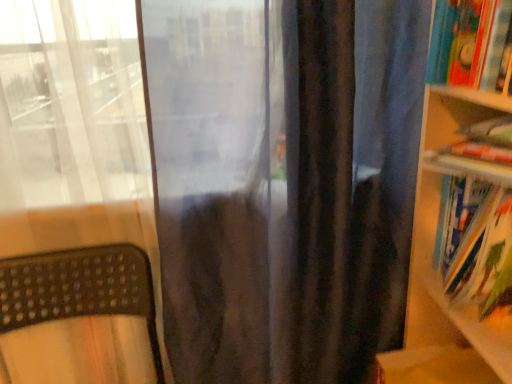
From the picture: Measure the distance between point (470, 260) and camera.

Point (470, 260) is 27.95 inches from camera.

The height and width of the screenshot is (384, 512). In order to click on hardcover book at right, arranged as the first book when ordered from the bottom in this screenshot , I will do `click(475, 244)`.

Which is more distant, [484,40] or [473,314]?

Positioned behind is point [473,314].

Is hardcover books at right completely or partially inside hardcover book at upper right, the 1th book in the top-to-bottom sequence?

No.

Is hardcover book at upper right, which ranks as the 2th book in bottom-to-top order, positioned far away from hardcover books at right?

No, hardcover book at upper right, which ranks as the 2th book in bottom-to-top order, is not far from hardcover books at right.

From a real-world perspective, is hardcover book at right, which ranks as the 2th book in top-to-bottom order, below hardcover book at upper right, which ranks as the 2th book in bottom-to-top order?

Yes, from a real-world perspective, hardcover book at right, which ranks as the 2th book in top-to-bottom order, is beneath hardcover book at upper right, which ranks as the 2th book in bottom-to-top order.

Is hardcover book at right, arranged as the first book when ordered from the bottom, positioned beyond the bounds of hardcover book at upper right, which ranks as the 2th book in bottom-to-top order?

Yes, hardcover book at right, arranged as the first book when ordered from the bottom, is located beyond the bounds of hardcover book at upper right, which ranks as the 2th book in bottom-to-top order.

This screenshot has width=512, height=384. Find the location of `book that appears behind the hardcover book at right, which ranks as the 2th book in top-to-bottom order`. book that appears behind the hardcover book at right, which ranks as the 2th book in top-to-bottom order is located at coordinates (471, 44).

From the image's perspective, is hardcover book at right, arranged as the first book when ordered from the bottom, above or below hardcover book at upper right, the 1th book in the top-to-bottom sequence?

From the image's perspective, hardcover book at right, arranged as the first book when ordered from the bottom, appears below hardcover book at upper right, the 1th book in the top-to-bottom sequence.

Is brown textured mat at lower left at the right side of hardcover books at right?

No.

What's the angular difference between brown textured mat at lower left and hardcover books at right's facing directions?

They differ by 95.6 degrees in their facing directions.

Does brown textured mat at lower left contain hardcover books at right?

No, hardcover books at right is not a part of brown textured mat at lower left.

Is brown textured mat at lower left with hardcover books at right?

They are not placed beside each other.

Based on the photo, does brown textured mat at lower left lie in front of hardcover book at upper right, the 1th book in the top-to-bottom sequence?

That is True.

From the picture: From a real-world perspective, is brown textured mat at lower left below hardcover book at upper right, the 1th book in the top-to-bottom sequence?

Yes, from a real-world perspective, brown textured mat at lower left is beneath hardcover book at upper right, the 1th book in the top-to-bottom sequence.

Is brown textured mat at lower left directly adjacent to hardcover book at upper right, which ranks as the 2th book in bottom-to-top order?

brown textured mat at lower left is not next to hardcover book at upper right, which ranks as the 2th book in bottom-to-top order, and they're not touching.

Based on their sizes in the image, would you say brown textured mat at lower left is bigger or smaller than hardcover book at upper right, which ranks as the 2th book in bottom-to-top order?

brown textured mat at lower left is bigger than hardcover book at upper right, which ranks as the 2th book in bottom-to-top order.

Considering the relative sizes of hardcover books at right and brown textured mat at lower left in the image provided, is hardcover books at right bigger than brown textured mat at lower left?

No, hardcover books at right is not bigger than brown textured mat at lower left.

Is hardcover books at right aimed at brown textured mat at lower left?

Yes, hardcover books at right is aimed at brown textured mat at lower left.

Between hardcover books at right and brown textured mat at lower left, which one is positioned in front?

Positioned in front is hardcover books at right.

From the image's perspective, is hardcover books at right positioned above or below brown textured mat at lower left?

hardcover books at right is above brown textured mat at lower left.

From a real-world perspective, which object stands above the other?

hardcover book at right, arranged as the first book when ordered from the bottom.

From the picture: Is brown textured mat at lower left touching hardcover book at right, which ranks as the 2th book in top-to-bottom order?

No, brown textured mat at lower left is not in contact with hardcover book at right, which ranks as the 2th book in top-to-bottom order.

Which is less distant, [17,266] or [508,248]?

Point [17,266].

Does brown textured mat at lower left have a larger size compared to hardcover book at right, arranged as the first book when ordered from the bottom?

Yes.

Considering the sizes of objects hardcover book at upper right, which ranks as the 2th book in bottom-to-top order, and hardcover book at right, arranged as the first book when ordered from the bottom, in the image provided, who is thinner, hardcover book at upper right, which ranks as the 2th book in bottom-to-top order, or hardcover book at right, arranged as the first book when ordered from the bottom,?

With smaller width is hardcover book at upper right, which ranks as the 2th book in bottom-to-top order.

Is hardcover book at upper right, which ranks as the 2th book in bottom-to-top order, in contact with hardcover book at right, arranged as the first book when ordered from the bottom?

There is a gap between hardcover book at upper right, which ranks as the 2th book in bottom-to-top order, and hardcover book at right, arranged as the first book when ordered from the bottom.

What's the angular difference between hardcover book at upper right, which ranks as the 2th book in bottom-to-top order, and hardcover book at right, which ranks as the 2th book in top-to-bottom order,'s facing directions?

There is a 0.625-degree angle between the facing directions of hardcover book at upper right, which ranks as the 2th book in bottom-to-top order, and hardcover book at right, which ranks as the 2th book in top-to-bottom order.

Locate an element on the screen. This screenshot has height=384, width=512. the 2nd book behind the hardcover books at right, counting from the anchor's position is located at coordinates (471, 44).

Identify the location of book on the right of hardcover book at upper right, the 1th book in the top-to-bottom sequence. (475, 244).

Based on their spatial positions, is hardcover book at right, which ranks as the 2th book in top-to-bottom order, or hardcover books at right closer to brown textured mat at lower left?

Among the two, hardcover books at right is located nearer to brown textured mat at lower left.

Based on their spatial positions, is brown textured mat at lower left or hardcover books at right closer to hardcover book at upper right, which ranks as the 2th book in bottom-to-top order?

The object closer to hardcover book at upper right, which ranks as the 2th book in bottom-to-top order, is hardcover books at right.

From the image, which object appears to be nearer to brown textured mat at lower left, hardcover books at right or hardcover book at right, which ranks as the 2th book in top-to-bottom order?

hardcover books at right is positioned closer to the anchor brown textured mat at lower left.

From the image, which object appears to be nearer to hardcover book at upper right, the 1th book in the top-to-bottom sequence, hardcover book at right, arranged as the first book when ordered from the bottom, or brown textured mat at lower left?

hardcover book at right, arranged as the first book when ordered from the bottom, is positioned closer to the anchor hardcover book at upper right, the 1th book in the top-to-bottom sequence.

Looking at this image, which object lies nearer to the anchor point hardcover books at right, hardcover book at upper right, which ranks as the 2th book in bottom-to-top order, or brown textured mat at lower left?

Among the two, hardcover book at upper right, which ranks as the 2th book in bottom-to-top order, is located nearer to hardcover books at right.

Looking at the image, which one is located closer to hardcover books at right, brown textured mat at lower left or hardcover book at right, which ranks as the 2th book in top-to-bottom order?

The object closer to hardcover books at right is hardcover book at right, which ranks as the 2th book in top-to-bottom order.

Which object lies further to the anchor point hardcover books at right, hardcover book at upper right, which ranks as the 2th book in bottom-to-top order, or hardcover book at right, which ranks as the 2th book in top-to-bottom order?

hardcover book at upper right, which ranks as the 2th book in bottom-to-top order, is positioned further to the anchor hardcover books at right.

Estimate the real-world distances between objects in this image. Which object is closer to hardcover book at right, arranged as the first book when ordered from the bottom, hardcover book at upper right, which ranks as the 2th book in bottom-to-top order, or hardcover books at right?

The object closer to hardcover book at right, arranged as the first book when ordered from the bottom, is hardcover books at right.

Where is `bookcase that lies between hardcover book at upper right, the 1th book in the top-to-bottom sequence, and hardcover book at right, arranged as the first book when ordered from the bottom, from top to bottom`? Image resolution: width=512 pixels, height=384 pixels. bookcase that lies between hardcover book at upper right, the 1th book in the top-to-bottom sequence, and hardcover book at right, arranged as the first book when ordered from the bottom, from top to bottom is located at coordinates (460, 243).

Find the location of a particular element. The image size is (512, 384). book situated between brown textured mat at lower left and hardcover book at right, arranged as the first book when ordered from the bottom, from left to right is located at coordinates (471, 44).